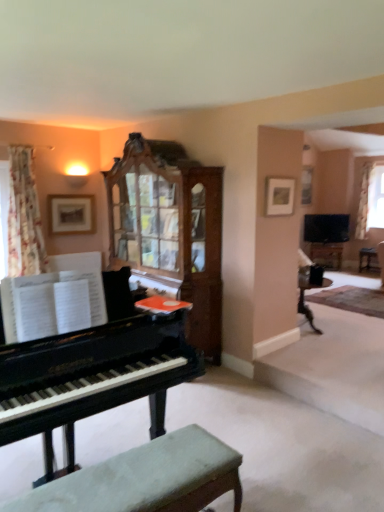
Question: From the image's perspective, would you say white sheer curtain at upper right, the second curtain in the left-to-right sequence, is positioned over clear glass cabinet at upper center?

Choices:
 (A) no
 (B) yes

Answer: (A)

Question: From a real-world perspective, is white sheer curtain at upper right, which is the second curtain from front to back, below clear glass cabinet at upper center?

Choices:
 (A) yes
 (B) no

Answer: (A)

Question: Is white sheer curtain at upper right, which is the first curtain from back to front, shorter than clear glass cabinet at upper center?

Choices:
 (A) yes
 (B) no

Answer: (B)

Question: Does white sheer curtain at upper right, which is the second curtain from front to back, have a smaller size compared to clear glass cabinet at upper center?

Choices:
 (A) yes
 (B) no

Answer: (B)

Question: Is white sheer curtain at upper right, the second curtain in the left-to-right sequence, surrounding clear glass cabinet at upper center?

Choices:
 (A) no
 (B) yes

Answer: (A)

Question: Can you confirm if white sheer curtain at upper right, which is the first curtain from back to front, is taller than clear glass cabinet at upper center?

Choices:
 (A) yes
 (B) no

Answer: (A)

Question: Can you confirm if green fabric bench at lower center is bigger than flat-screen tv at upper right?

Choices:
 (A) yes
 (B) no

Answer: (B)

Question: Is green fabric bench at lower center smaller than flat-screen tv at upper right?

Choices:
 (A) no
 (B) yes

Answer: (B)

Question: Is green fabric bench at lower center turned away from flat-screen tv at upper right?

Choices:
 (A) no
 (B) yes

Answer: (A)

Question: Is green fabric bench at lower center closer to the viewer compared to flat-screen tv at upper right?

Choices:
 (A) yes
 (B) no

Answer: (A)

Question: Does green fabric bench at lower center appear on the right side of flat-screen tv at upper right?

Choices:
 (A) yes
 (B) no

Answer: (B)

Question: Can you confirm if green fabric bench at lower center is thinner than flat-screen tv at upper right?

Choices:
 (A) yes
 (B) no

Answer: (B)

Question: Is white sheer curtain at upper right, which is the first curtain from back to front, looking in the opposite direction of matte wooden picture frame at upper center, the 2th picture frame viewed from the left?

Choices:
 (A) yes
 (B) no

Answer: (B)